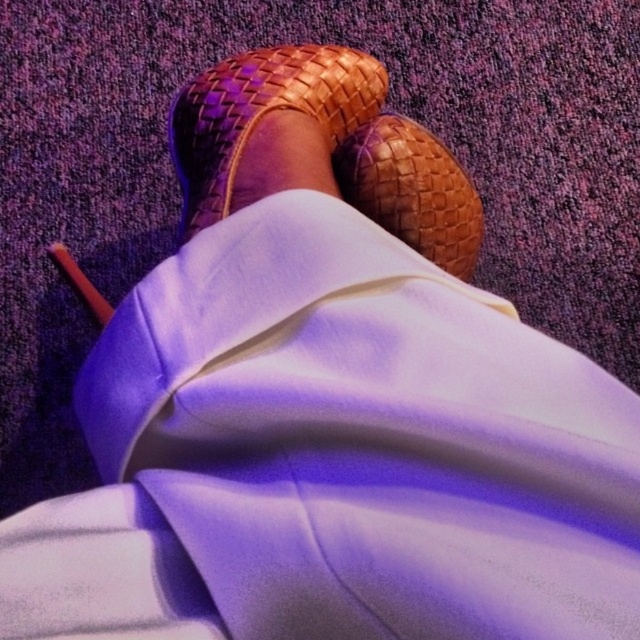
Is brown woven sandal at center wider than brown woven shoe at center?

Yes, brown woven sandal at center is wider than brown woven shoe at center.

Which is behind, point (225, 147) or point (442, 157)?

The point (442, 157) is more distant.

This screenshot has width=640, height=640. Identify the location of brown woven sandal at center. click(262, 112).